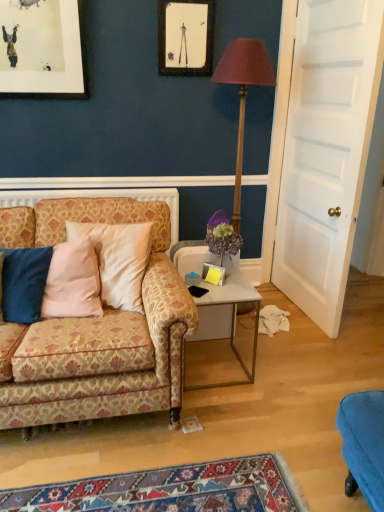
Where is `vacant space to the right of patterned fabric couch at left`? The height and width of the screenshot is (512, 384). vacant space to the right of patterned fabric couch at left is located at coordinates (277, 398).